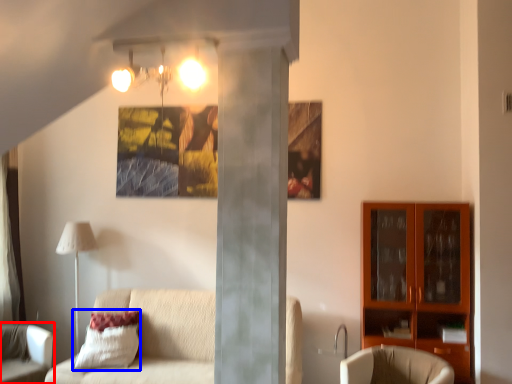
Question: Which object is closer to the camera taking this photo, chair (highlighted by a red box) or pillow (highlighted by a blue box)?

Choices:
 (A) chair
 (B) pillow

Answer: (A)